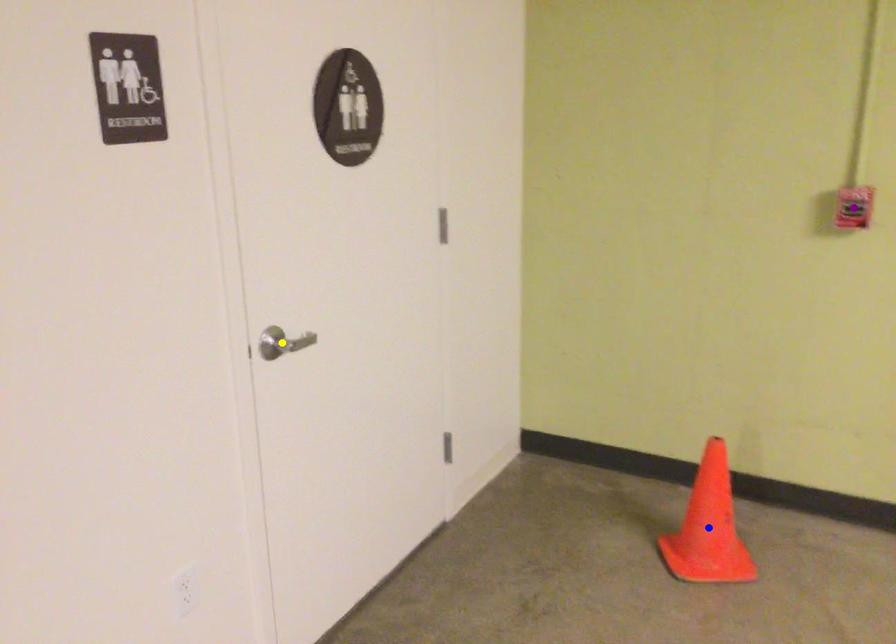
Order these from nearest to farthest:
A) yellow point
B) purple point
C) blue point

blue point → purple point → yellow point